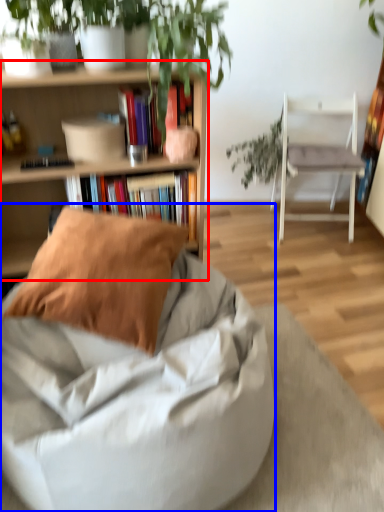
Question: Which object is closer to the camera taking this photo, shelf (highlighted by a red box) or chair (highlighted by a blue box)?

Choices:
 (A) shelf
 (B) chair

Answer: (B)